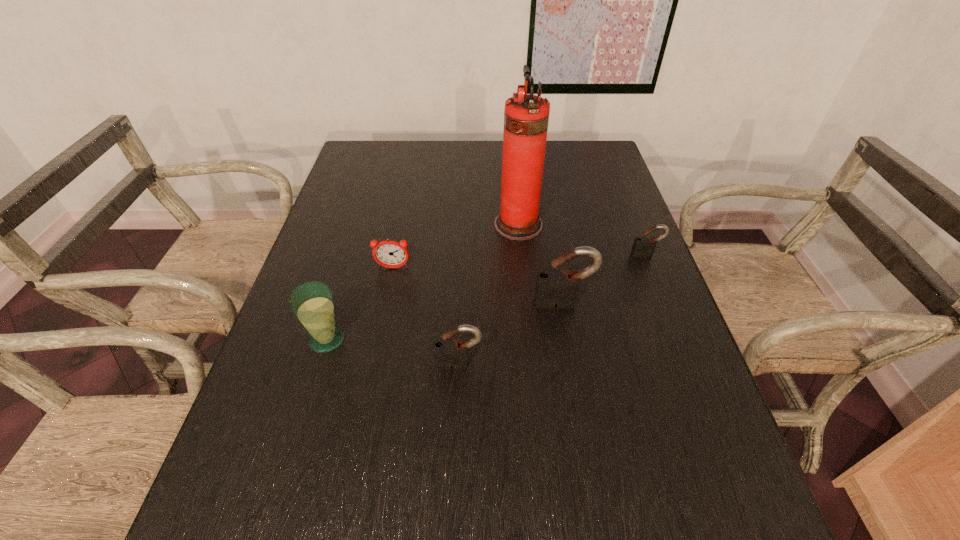
Locate an element on the screen. The height and width of the screenshot is (540, 960). free point that keeps the padlocks evenly spaced on the left is located at coordinates (324, 442).